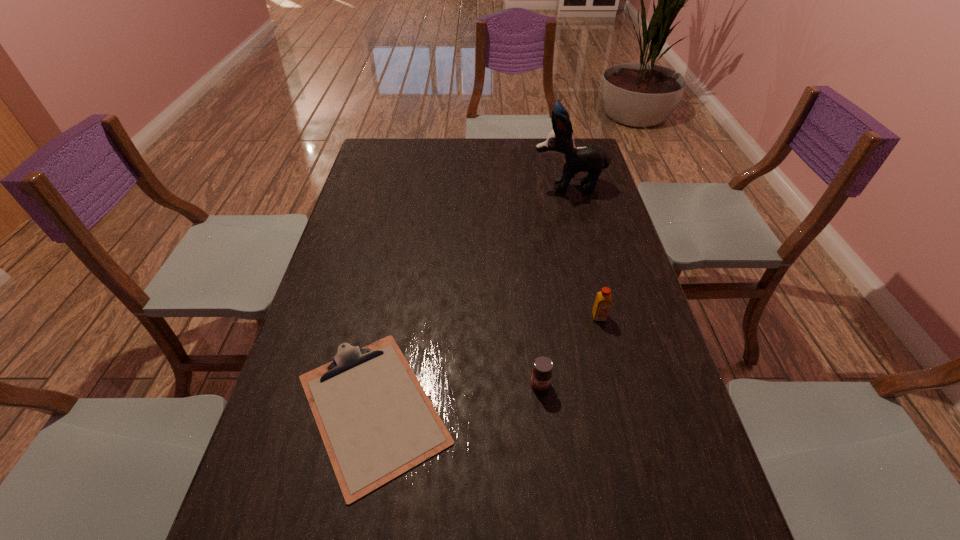
Find the location of a particular element. The height and width of the screenshot is (540, 960). free spot at the far left corner of the desktop is located at coordinates (398, 141).

You are a GUI agent. You are given a task and a screenshot of the screen. Output one action in this format:
    pyautogui.click(x=<x>, y=<y>)
    Task: Click on the empty space that is in between the jam and the orange juice
    Image resolution: width=960 pixels, height=540 pixels.
    Given the screenshot: What is the action you would take?
    pyautogui.click(x=569, y=350)

Locate an element on the screen. The height and width of the screenshot is (540, 960). free space between the third object from right to left and the third shortest object is located at coordinates (569, 350).

Where is `vacant space that's between the second farthest object and the tallest object`? vacant space that's between the second farthest object and the tallest object is located at coordinates (584, 251).

I want to click on free space between the jam and the puppy, so click(x=554, y=285).

At what (x,y) coordinates should I click in order to perform the action: click on blank region between the second shortest object and the clipboard. Please return your answer as a coordinate pair (x, y). Looking at the image, I should click on (456, 396).

I want to click on empty location between the third shortest object and the third object from right to left, so click(x=569, y=350).

The width and height of the screenshot is (960, 540). In order to click on vacant point located between the leftmost object and the third nearest object in this screenshot , I will do `click(486, 362)`.

Find the location of a particular element. The height and width of the screenshot is (540, 960). vacant space that is in between the jam and the shortest object is located at coordinates (456, 396).

I want to click on free spot between the tallest object and the shortest object, so click(x=470, y=297).